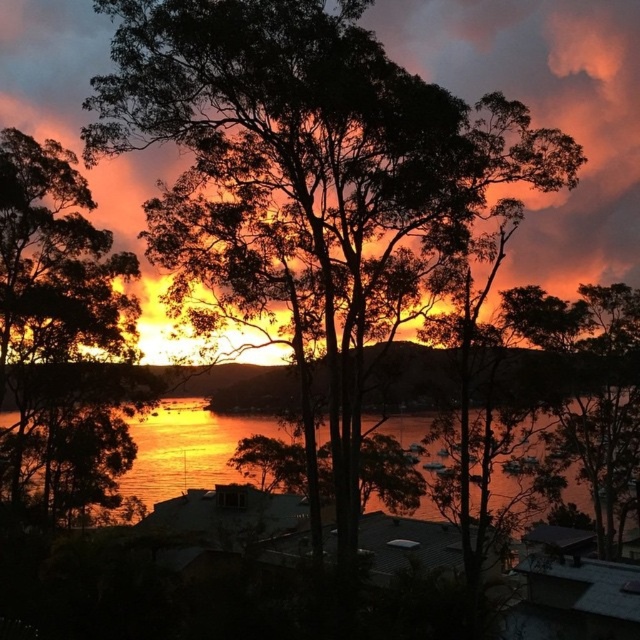
Identify the location of silhouette leafy tree at left. The height and width of the screenshot is (640, 640). (51, 304).

Is point (65, 152) more distant than point (157, 460)?

No, it is not.

Who is more distant from viewer, (77, 339) or (628, 484)?

The point (628, 484) is behind.

Where is `silhouette leafy tree at left`? silhouette leafy tree at left is located at coordinates (51, 304).

Who is shorter, orange matte cloud at upper center or silhouette leafy tree at left?

silhouette leafy tree at left

Which is above, orange matte cloud at upper center or silhouette leafy tree at left?

orange matte cloud at upper center

Identify the location of orange matte cloud at upper center. pyautogui.click(x=545, y=115).

Locate an element on the screen. This screenshot has width=640, height=640. orange matte cloud at upper center is located at coordinates (545, 115).

Is orange matte cloud at upper center thinner than glistening water at center?

Incorrect, orange matte cloud at upper center's width is not less than glistening water at center's.

Describe the element at coordinates (545, 115) in the screenshot. This screenshot has height=640, width=640. I see `orange matte cloud at upper center` at that location.

I want to click on orange matte cloud at upper center, so click(x=545, y=115).

Identify the location of orange matte cloud at upper center. The height and width of the screenshot is (640, 640). point(545,115).